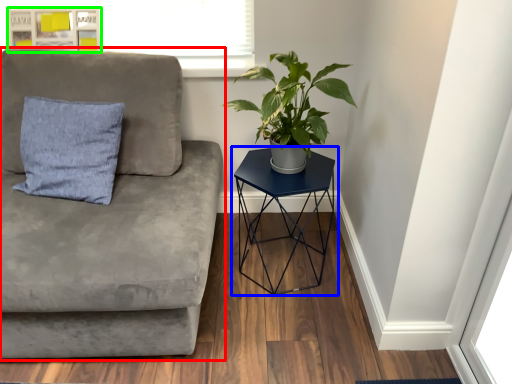
Question: Based on their relative distances, which object is farther from studio couch (highlighted by a red box)? Choose from table (highlighted by a blue box) and bulletin board (highlighted by a green box).

Choices:
 (A) table
 (B) bulletin board

Answer: (B)